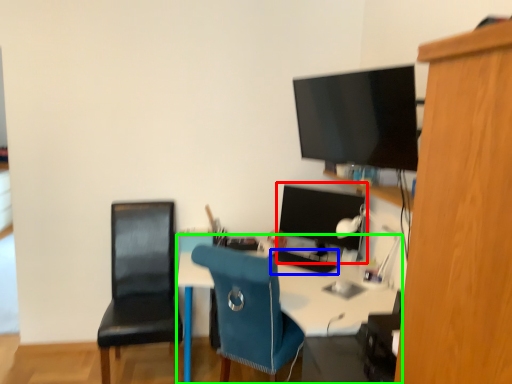
Question: Based on their relative distances, which object is farther from computer monitor (highlighted by a red box)? Choose from keyboard (highlighted by a blue box) and desk (highlighted by a green box).

Choices:
 (A) keyboard
 (B) desk

Answer: (B)